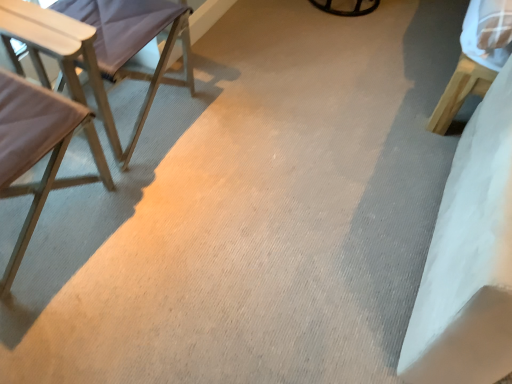
This screenshot has height=384, width=512. What do you see at coordinates (133, 40) in the screenshot?
I see `light purple fabric chair at left, placed as the 2th chair when sorted from bottom to top` at bounding box center [133, 40].

Where is `light purple fabric chair at left, the first chair when ordered from top to bottom`? light purple fabric chair at left, the first chair when ordered from top to bottom is located at coordinates (133, 40).

Measure the distance between light purple fabric chair at left, placed as the 2th chair when sorted from bottom to top, and camera.

light purple fabric chair at left, placed as the 2th chair when sorted from bottom to top, and camera are 4.33 feet apart.

Image resolution: width=512 pixels, height=384 pixels. What do you see at coordinates (38, 150) in the screenshot? I see `light beige fabric chair at left, the 1th chair ordered from the bottom` at bounding box center [38, 150].

What is the approximate height of light beige fabric chair at left, the 1th chair ordered from the bottom?

32.19 inches.

What are the coordinates of `light beige fabric chair at left, the 2th chair in the top-to-bottom sequence` in the screenshot? It's located at (38, 150).

The image size is (512, 384). I want to click on light purple fabric chair at left, placed as the 2th chair when sorted from bottom to top, so click(133, 40).

Which object is positioned more to the left, light purple fabric chair at left, placed as the 2th chair when sorted from bottom to top, or light beige fabric chair at left, the 1th chair ordered from the bottom?

light beige fabric chair at left, the 1th chair ordered from the bottom, is more to the left.

Considering the positions of objects light purple fabric chair at left, placed as the 2th chair when sorted from bottom to top, and light beige fabric chair at left, the 1th chair ordered from the bottom, in the image provided, who is behind, light purple fabric chair at left, placed as the 2th chair when sorted from bottom to top, or light beige fabric chair at left, the 1th chair ordered from the bottom,?

light purple fabric chair at left, placed as the 2th chair when sorted from bottom to top, is behind.

Which is closer, (192, 78) or (22, 116)?

Positioned in front is point (22, 116).

From the image's perspective, which object appears higher, light purple fabric chair at left, the first chair when ordered from top to bottom, or light beige fabric chair at left, the 2th chair in the top-to-bottom sequence?

From the image's view, light purple fabric chair at left, the first chair when ordered from top to bottom, is above.

From a real-world perspective, relative to light beige fabric chair at left, the 2th chair in the top-to-bottom sequence, is light purple fabric chair at left, placed as the 2th chair when sorted from bottom to top, vertically above or below?

light purple fabric chair at left, placed as the 2th chair when sorted from bottom to top, is situated lower than light beige fabric chair at left, the 2th chair in the top-to-bottom sequence, in the real world.

Does light purple fabric chair at left, placed as the 2th chair when sorted from bottom to top, have a greater width compared to light beige fabric chair at left, the 2th chair in the top-to-bottom sequence?

Yes, light purple fabric chair at left, placed as the 2th chair when sorted from bottom to top, is wider than light beige fabric chair at left, the 2th chair in the top-to-bottom sequence.

Consider the image. Between light purple fabric chair at left, the first chair when ordered from top to bottom, and light beige fabric chair at left, the 1th chair ordered from the bottom, which one has less height?

light purple fabric chair at left, the first chair when ordered from top to bottom.

Does light purple fabric chair at left, placed as the 2th chair when sorted from bottom to top, have a smaller size compared to light beige fabric chair at left, the 1th chair ordered from the bottom?

Actually, light purple fabric chair at left, placed as the 2th chair when sorted from bottom to top, might be larger than light beige fabric chair at left, the 1th chair ordered from the bottom.

From the picture: Which is correct: light purple fabric chair at left, the first chair when ordered from top to bottom, is inside light beige fabric chair at left, the 1th chair ordered from the bottom, or outside of it?

light purple fabric chair at left, the first chair when ordered from top to bottom, cannot be found inside light beige fabric chair at left, the 1th chair ordered from the bottom.

Looking at this image, is light purple fabric chair at left, the first chair when ordered from top to bottom, facing towards light beige fabric chair at left, the 1th chair ordered from the bottom?

No, light purple fabric chair at left, the first chair when ordered from top to bottom, is not turned towards light beige fabric chair at left, the 1th chair ordered from the bottom.

What's the angular difference between light purple fabric chair at left, the first chair when ordered from top to bottom, and light beige fabric chair at left, the 1th chair ordered from the bottom,'s facing directions?

There is a 0.193-degree angle between the facing directions of light purple fabric chair at left, the first chair when ordered from top to bottom, and light beige fabric chair at left, the 1th chair ordered from the bottom.

Where is `chair to the right of light beige fabric chair at left, the 1th chair ordered from the bottom`? The image size is (512, 384). chair to the right of light beige fabric chair at left, the 1th chair ordered from the bottom is located at coordinates (133, 40).

Is light beige fabric chair at left, the 1th chair ordered from the bottom, to the left or to the right of light purple fabric chair at left, the first chair when ordered from top to bottom, in the image?

light beige fabric chair at left, the 1th chair ordered from the bottom, is positioned on light purple fabric chair at left, the first chair when ordered from top to bottom,'s left side.

Is light beige fabric chair at left, the 2th chair in the top-to-bottom sequence, behind light purple fabric chair at left, placed as the 2th chair when sorted from bottom to top?

No, light beige fabric chair at left, the 2th chair in the top-to-bottom sequence, is closer to the viewer.

Considering the positions of points (29, 85) and (106, 57), is point (29, 85) closer to camera compared to point (106, 57)?

Yes, it is in front of point (106, 57).

From the image's perspective, is light beige fabric chair at left, the 1th chair ordered from the bottom, on top of light purple fabric chair at left, the first chair when ordered from top to bottom?

No, from the image's perspective, light beige fabric chair at left, the 1th chair ordered from the bottom, is not above light purple fabric chair at left, the first chair when ordered from top to bottom.

From a real-world perspective, which object rests below the other?

light purple fabric chair at left, the first chair when ordered from top to bottom, is physically lower.

Does light beige fabric chair at left, the 1th chair ordered from the bottom, have a lesser width compared to light purple fabric chair at left, placed as the 2th chair when sorted from bottom to top?

Correct, the width of light beige fabric chair at left, the 1th chair ordered from the bottom, is less than that of light purple fabric chair at left, placed as the 2th chair when sorted from bottom to top.

Between light beige fabric chair at left, the 2th chair in the top-to-bottom sequence, and light purple fabric chair at left, placed as the 2th chair when sorted from bottom to top, which one has less height?

light purple fabric chair at left, placed as the 2th chair when sorted from bottom to top.

Is light beige fabric chair at left, the 2th chair in the top-to-bottom sequence, bigger or smaller than light purple fabric chair at left, the first chair when ordered from top to bottom?

In the image, light beige fabric chair at left, the 2th chair in the top-to-bottom sequence, appears to be smaller than light purple fabric chair at left, the first chair when ordered from top to bottom.

Is light beige fabric chair at left, the 2th chair in the top-to-bottom sequence, outside of light purple fabric chair at left, the first chair when ordered from top to bottom?

Yes, light beige fabric chair at left, the 2th chair in the top-to-bottom sequence, is not within light purple fabric chair at left, the first chair when ordered from top to bottom.

Are light beige fabric chair at left, the 2th chair in the top-to-bottom sequence, and light purple fabric chair at left, placed as the 2th chair when sorted from bottom to top, making contact?

They are not placed beside each other.

Is light beige fabric chair at left, the 2th chair in the top-to-bottom sequence, looking in the opposite direction of light purple fabric chair at left, placed as the 2th chair when sorted from bottom to top?

light beige fabric chair at left, the 2th chair in the top-to-bottom sequence, does not have its back to light purple fabric chair at left, placed as the 2th chair when sorted from bottom to top.

Can you tell me how much light beige fabric chair at left, the 1th chair ordered from the bottom, and light purple fabric chair at left, placed as the 2th chair when sorted from bottom to top, differ in facing direction?

The angle between the facing direction of light beige fabric chair at left, the 1th chair ordered from the bottom, and the facing direction of light purple fabric chair at left, placed as the 2th chair when sorted from bottom to top, is 0.193 degrees.

Identify the location of chair positioned vertically above the light purple fabric chair at left, placed as the 2th chair when sorted from bottom to top (from a real-world perspective). Image resolution: width=512 pixels, height=384 pixels. (38, 150).

Where is `chair below the light beige fabric chair at left, the 1th chair ordered from the bottom (from a real-world perspective)`? chair below the light beige fabric chair at left, the 1th chair ordered from the bottom (from a real-world perspective) is located at coordinates (133, 40).

Where is `chair in front of the light purple fabric chair at left, the first chair when ordered from top to bottom`? The image size is (512, 384). chair in front of the light purple fabric chair at left, the first chair when ordered from top to bottom is located at coordinates (38, 150).